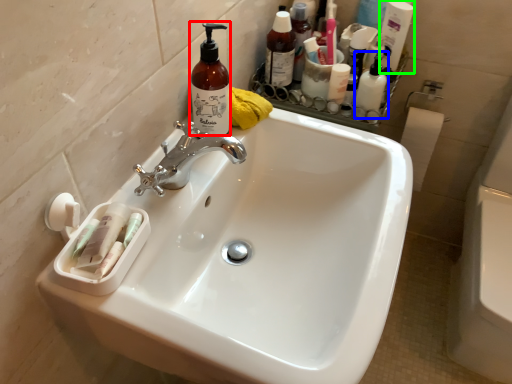
Question: Estimate the real-world distances between objects in this image. Which object is farther from cleaning product (highlighted by a red box), toiletry (highlighted by a blue box) or cleaning product (highlighted by a green box)?

Choices:
 (A) toiletry
 (B) cleaning product

Answer: (B)